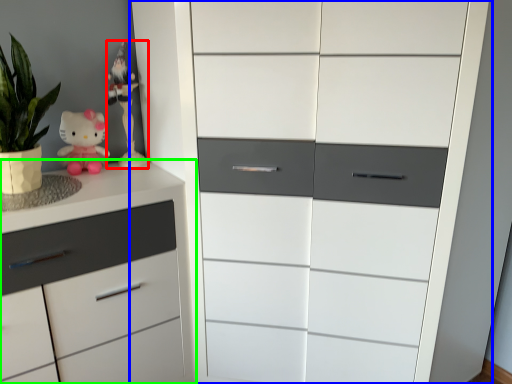
Question: Which object is the closest to the miniature (highlighted by a red box)? Choose among these: chest of drawers (highlighted by a blue box) or chest of drawers (highlighted by a green box).

Choices:
 (A) chest of drawers
 (B) chest of drawers

Answer: (B)